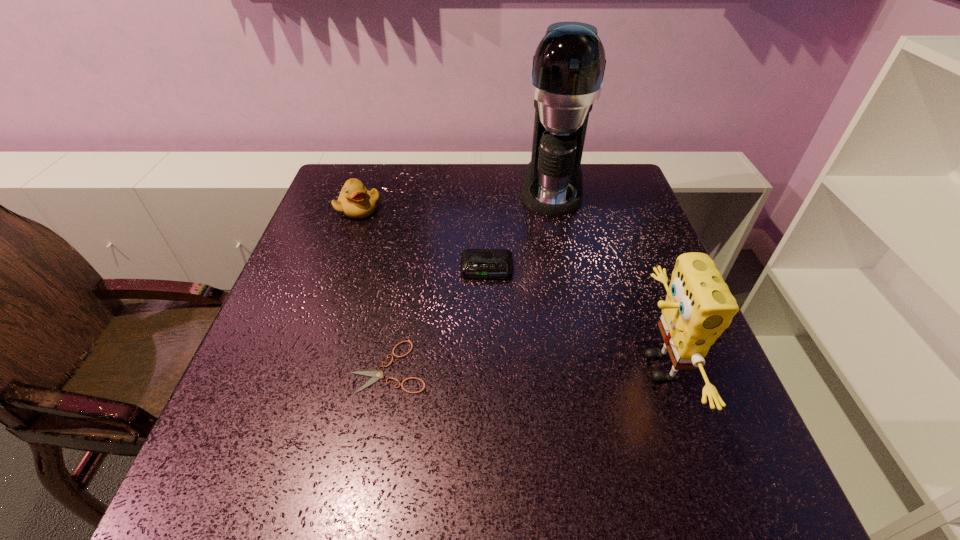
Locate an element on the screen. shears is located at coordinates (376, 375).

This screenshot has height=540, width=960. I want to click on the second object from left to right, so click(x=376, y=375).

You are a GUI agent. You are given a task and a screenshot of the screen. Output one action in this format:
    pyautogui.click(x=<x>, y=<y>)
    Task: Click on the sponge
    The image size is (960, 540).
    Given the screenshot: What is the action you would take?
    pyautogui.click(x=699, y=306)

This screenshot has height=540, width=960. Identify the location of alarm clock. (475, 263).

Identify the location of the third nearest object. (475, 263).

Where is `the leftmost object`? This screenshot has height=540, width=960. the leftmost object is located at coordinates [x=355, y=201].

Locate an element on the screen. The image size is (960, 540). duckling is located at coordinates (355, 201).

Find the location of a particular element. This screenshot has height=540, width=960. coffee maker is located at coordinates pyautogui.click(x=568, y=68).

The image size is (960, 540). I want to click on blank space located 0.250m on the right of the second object from left to right, so click(x=558, y=367).

Image resolution: width=960 pixels, height=540 pixels. I want to click on free space located 0.090m on the face of the fourth shortest object, so click(x=587, y=367).